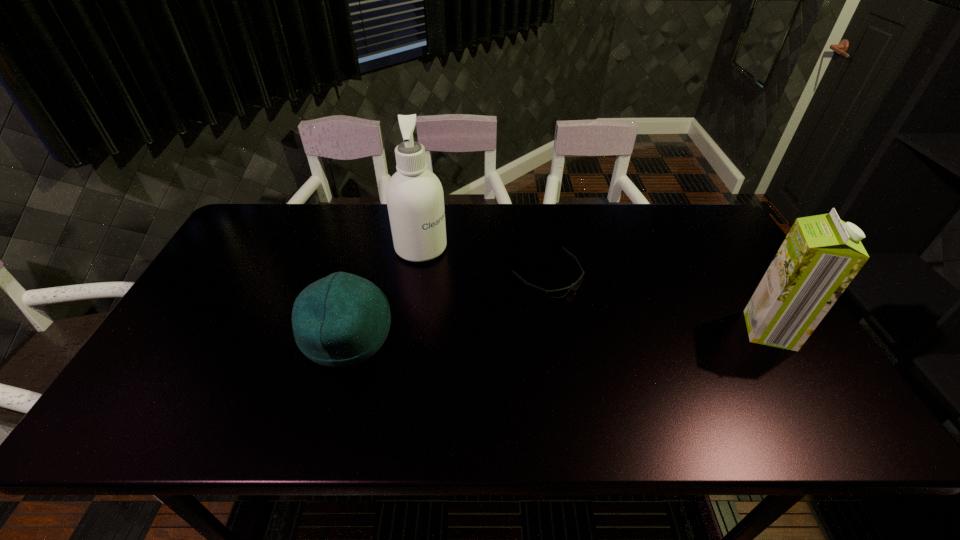
In the image, there is a desktop. Where is `vacant space at the far left corner`? vacant space at the far left corner is located at coordinates (266, 214).

This screenshot has width=960, height=540. I want to click on vacant region at the far right corner of the desktop, so click(x=679, y=205).

The height and width of the screenshot is (540, 960). Identify the location of vacant space at the near right corner of the desktop. (802, 395).

Where is `free area in between the sunglasses and the tallest object`? This screenshot has width=960, height=540. free area in between the sunglasses and the tallest object is located at coordinates (484, 262).

Locate an element on the screen. vacant area that lies between the rightmost object and the sunglasses is located at coordinates (659, 303).

The image size is (960, 540). Identify the location of free space that is in between the third shortest object and the shortest object. (659, 303).

Locate an element on the screen. The height and width of the screenshot is (540, 960). free space between the second object from right to left and the third shortest object is located at coordinates (659, 303).

Locate an element on the screen. The width and height of the screenshot is (960, 540). unoccupied position between the cleansing agent and the soya milk is located at coordinates (595, 289).

Image resolution: width=960 pixels, height=540 pixels. I want to click on free space between the beanie and the tallest object, so click(x=384, y=292).

Find the location of a particular element. Image resolution: width=960 pixels, height=540 pixels. free space between the beanie and the tallest object is located at coordinates (384, 292).